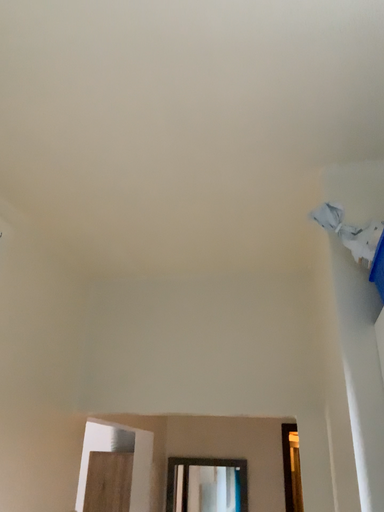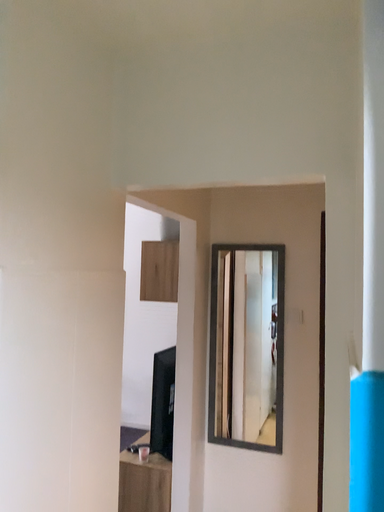
Question: Which way did the camera rotate in the video?

Choices:
 (A) rotated downward
 (B) rotated upward

Answer: (A)